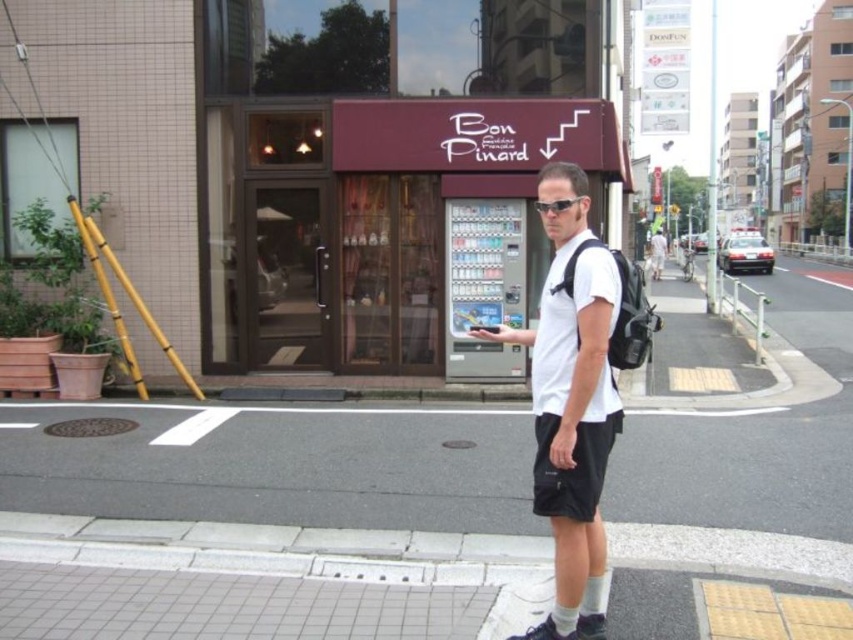
Can you confirm if white cotton shirt at center is shorter than sunglasses at center?

Incorrect, white cotton shirt at center's height does not fall short of sunglasses at center's.

Can you confirm if white cotton shirt at center is positioned to the left of sunglasses at center?

Incorrect, white cotton shirt at center is not on the left side of sunglasses at center.

What do you see at coordinates (657, 252) in the screenshot? This screenshot has width=853, height=640. I see `white cotton shirt at center` at bounding box center [657, 252].

You are a GUI agent. You are given a task and a screenshot of the screen. Output one action in this format:
    pyautogui.click(x=<x>, y=<y>)
    Task: Click on the white cotton shirt at center
    This screenshot has height=640, width=853.
    Given the screenshot: What is the action you would take?
    point(657,252)

Is point (589, 371) farther from camera compared to point (554, 202)?

That is False.

Can you confirm if white matte shorts at center is thinner than sunglasses at center?

Incorrect, white matte shorts at center's width is not less than sunglasses at center's.

Who is more forward, [579,230] or [558,200]?

Point [558,200] is more forward.

Find the location of a particular element. Image resolution: width=853 pixels, height=640 pixels. white matte shorts at center is located at coordinates (572, 406).

Does white matte shorts at center have a lesser width compared to white cotton shirt at center?

Yes.

Between point (556, 577) and point (666, 252), which one is positioned behind?

Point (666, 252)

Find the location of a particular element. The width and height of the screenshot is (853, 640). white matte shorts at center is located at coordinates (572, 406).